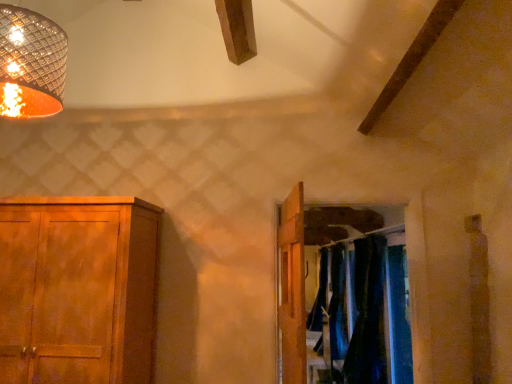
Question: In the image, is wooden door at center positioned in front of or behind velvet dark blue curtains at right, marked as the second curtain in a back-to-front arrangement?

Choices:
 (A) behind
 (B) front

Answer: (B)

Question: In terms of height, does wooden door at center look taller or shorter compared to velvet dark blue curtains at right, marked as the second curtain in a back-to-front arrangement?

Choices:
 (A) tall
 (B) short

Answer: (B)

Question: Considering the real-world distances, which object is closest to the wooden cabinet at left?

Choices:
 (A) blue velvet curtains at center, which appears as the 2th curtain when viewed from the front
 (B) metallic woven shade at upper left
 (C) velvet dark blue curtains at right, which is the 1th curtain in front-to-back order
 (D) dark blue fabric at center
 (E) wooden door at center

Answer: (B)

Question: Which of these objects is positioned farthest from the wooden cabinet at left?

Choices:
 (A) blue velvet curtains at center, arranged as the 1th curtain when viewed from the back
 (B) wooden door at center
 (C) metallic woven shade at upper left
 (D) velvet dark blue curtains at right, which is the 1th curtain in front-to-back order
 (E) dark blue fabric at center

Answer: (D)